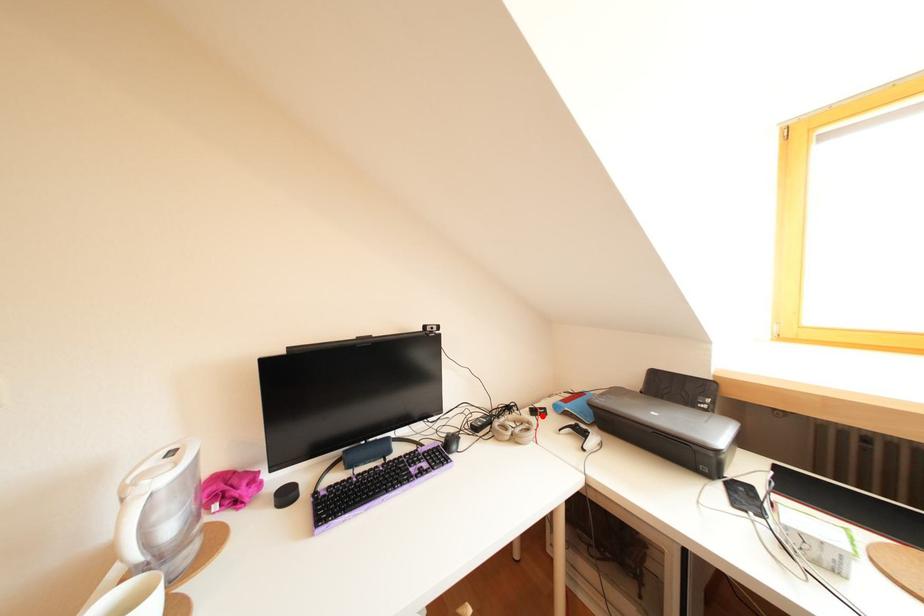
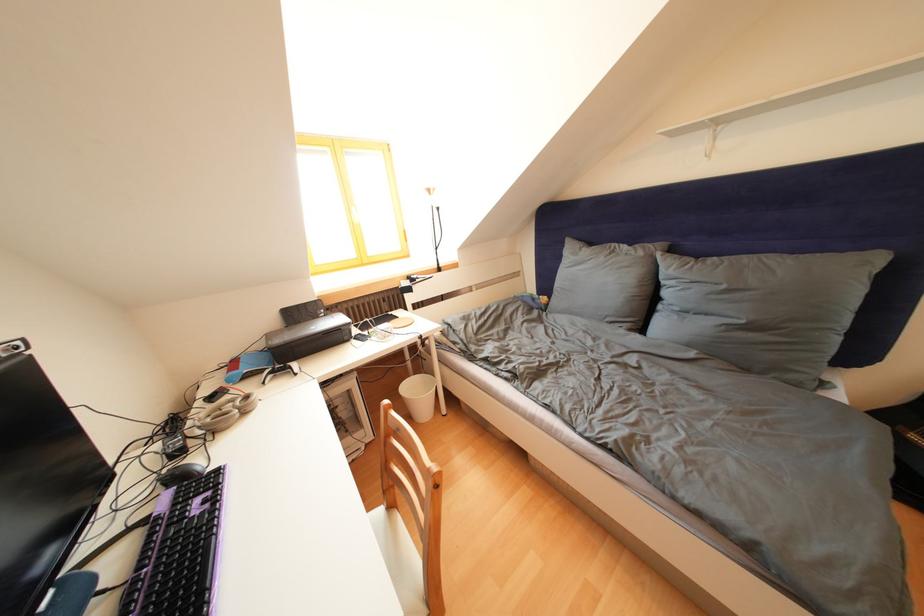
Where in the second image is the point corresponding to the highlighted location from the first image?

(220, 403)